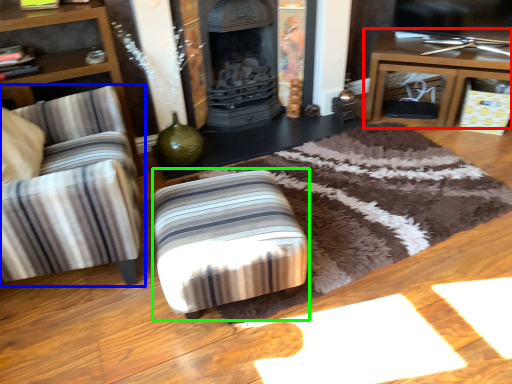
Question: Considering the real-world distances, which object is closest to table (highlighted by a red box)? chair (highlighted by a blue box) or stool (highlighted by a green box).

Choices:
 (A) chair
 (B) stool

Answer: (B)